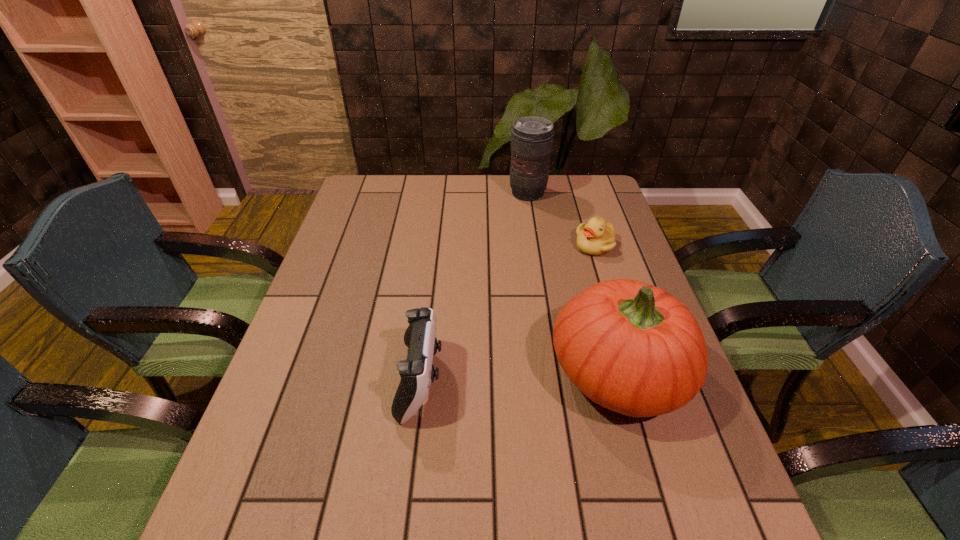
You are a GUI agent. You are given a task and a screenshot of the screen. Output one action in this format:
    pyautogui.click(x=<x>, y=<y>)
    Task: Click on the free space between the second farthest object and the telephoto lens
    The width and height of the screenshot is (960, 540).
    Given the screenshot: What is the action you would take?
    pyautogui.click(x=562, y=220)

The width and height of the screenshot is (960, 540). I want to click on object that stands as the second closest to the third tallest object, so click(597, 237).

Find the location of a particular element. Image resolution: width=960 pixels, height=540 pixels. object that stands as the third closest to the leftmost object is located at coordinates (532, 137).